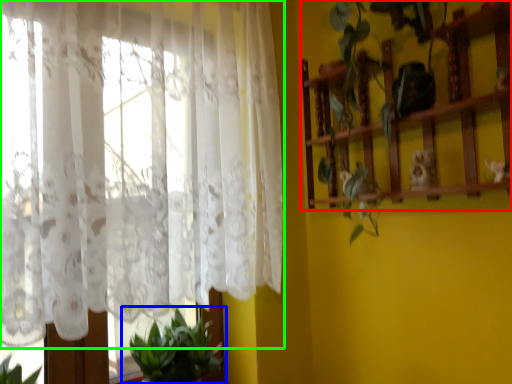
Question: Considering the real-world distances, which object is closest to shelf (highlighted by a red box)? houseplant (highlighted by a blue box) or curtain (highlighted by a green box).

Choices:
 (A) houseplant
 (B) curtain

Answer: (B)